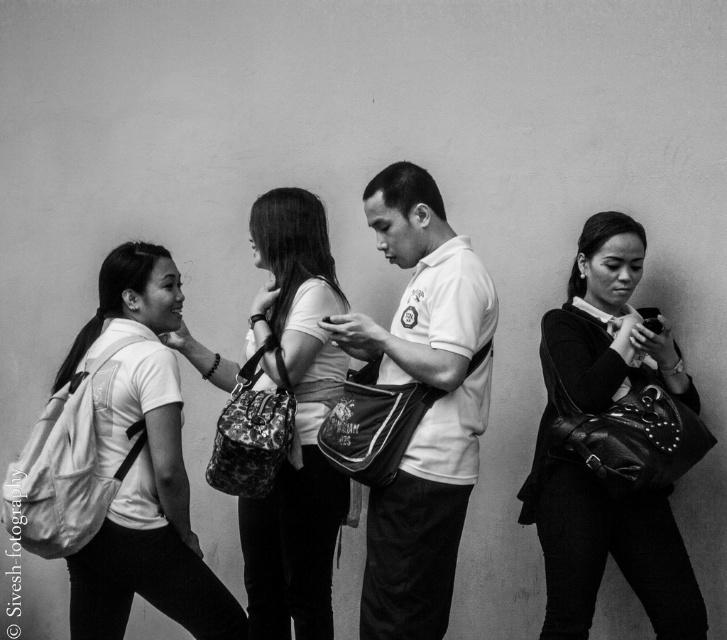
Which of these two, leather handbag at center or matte white shirt at center, stands taller?

Standing taller between the two is matte white shirt at center.

Is leather handbag at center to the right of matte white shirt at center from the viewer's perspective?

Correct, you'll find leather handbag at center to the right of matte white shirt at center.

Is point (606, 436) farther from viewer compared to point (308, 221)?

No.

You are a GUI agent. You are given a task and a screenshot of the screen. Output one action in this format:
    pyautogui.click(x=<x>, y=<y>)
    Task: Click on the leather handbag at center
    
    Given the screenshot: What is the action you would take?
    pos(611,444)

Is white matte shirt at center thinner than white fabric backpack at left?

Yes.

What do you see at coordinates (427, 410) in the screenshot? The width and height of the screenshot is (727, 640). I see `white matte shirt at center` at bounding box center [427, 410].

Which is in front, point (401, 307) or point (111, 625)?

Point (111, 625)

This screenshot has height=640, width=727. Find the location of `white matte shirt at center`. white matte shirt at center is located at coordinates (427, 410).

Between white matte shirt at center and matte white shirt at center, which one appears on the left side from the viewer's perspective?

matte white shirt at center is more to the left.

Who is more forward, [364,342] or [230,378]?

Point [364,342]

The image size is (727, 640). What are the coordinates of `white matte shirt at center` in the screenshot? It's located at (427, 410).